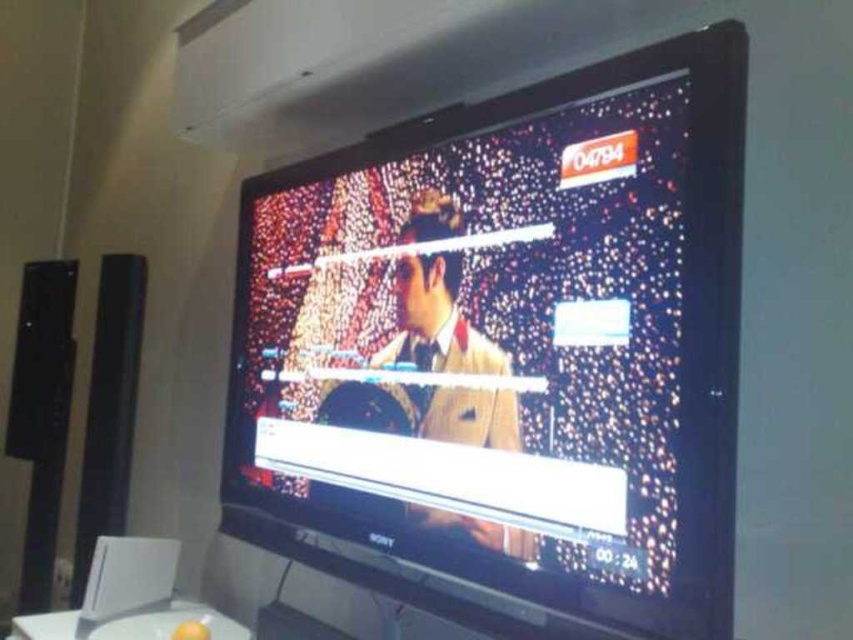
Is smooth beige suit at center further to the viewer compared to black matte speaker at left?

No, it is in front of black matte speaker at left.

Between smooth beige suit at center and black matte speaker at left, which one is positioned higher?

smooth beige suit at center

Describe the element at coordinates (436, 321) in the screenshot. The image size is (853, 640). I see `smooth beige suit at center` at that location.

What are the coordinates of `smooth beige suit at center` in the screenshot? It's located at (436, 321).

Measure the distance between black glossy tv at upper center and camera.

black glossy tv at upper center is 85.09 centimeters from camera.

Can you confirm if black glossy tv at upper center is bigger than smooth beige suit at center?

Yes.

Does point (318, 298) come in front of point (434, 396)?

That is False.

Locate an element on the screen. Image resolution: width=853 pixels, height=640 pixels. black glossy tv at upper center is located at coordinates (509, 349).

Can you confirm if black glossy tv at upper center is smaller than black matte speaker at left?

Incorrect, black glossy tv at upper center is not smaller in size than black matte speaker at left.

Between point (677, 248) and point (73, 596), which one is positioned in front?

Point (677, 248)

Locate an element on the screen. This screenshot has height=640, width=853. black glossy tv at upper center is located at coordinates (509, 349).

The height and width of the screenshot is (640, 853). I want to click on black glossy tv at upper center, so click(x=509, y=349).